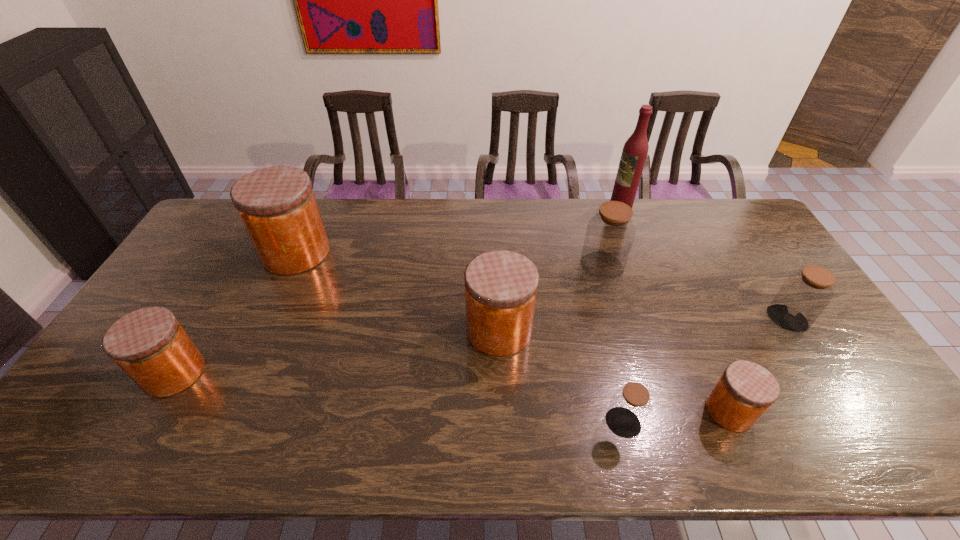
You are a GUI agent. You are given a task and a screenshot of the screen. Output one action in this format:
    pyautogui.click(x=<x>, y=<y>)
    Task: Click on the dark liquor
    
    Given the screenshot: What is the action you would take?
    pyautogui.click(x=635, y=150)

The width and height of the screenshot is (960, 540). Find the location of `liquor`. liquor is located at coordinates click(x=635, y=150).

This screenshot has width=960, height=540. Identify the location of the second tallest object. (278, 208).

This screenshot has height=540, width=960. What are the coordinates of `the farthest orange jar` in the screenshot? It's located at (278, 208).

Identify the location of the biggest brown jar. (610, 233).

Identify the location of the third jar from left to right. Image resolution: width=960 pixels, height=540 pixels. pos(501,286).

What are the coordinates of `the sixth object from right to left` in the screenshot? It's located at (501, 286).

You are a GUI agent. You are given a task and a screenshot of the screen. Output one action in this format:
    pyautogui.click(x=<x>, y=<y>)
    Task: Click on the second smallest brown jar
    This screenshot has width=960, height=540.
    Given the screenshot: What is the action you would take?
    pyautogui.click(x=803, y=296)

Where is `the second nearest brown jar`? This screenshot has height=540, width=960. the second nearest brown jar is located at coordinates (803, 296).

Find the location of a particular element. This screenshot has height=540, width=960. the third biggest orange jar is located at coordinates [x=149, y=344].